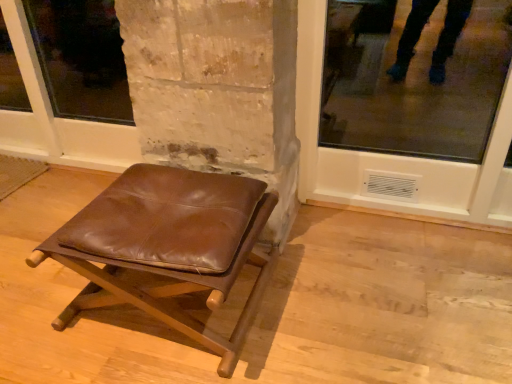
Identify the location of vacant space situated on the left part of brown leather stool at center. The image size is (512, 384). [41, 302].